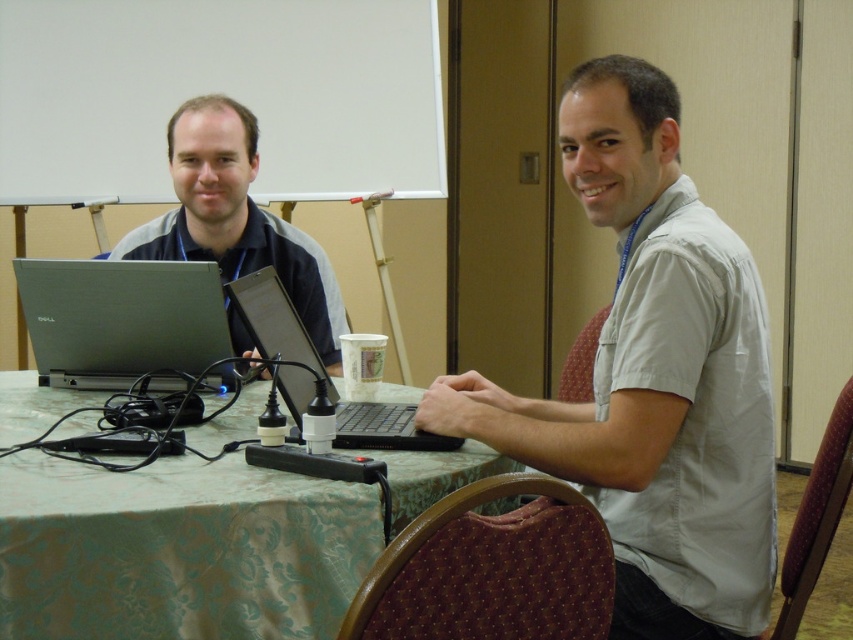
Question: Does light gray shirt at center have a smaller size compared to green fabric table at center?

Choices:
 (A) no
 (B) yes

Answer: (B)

Question: Which of the following is the farthest from the observer?

Choices:
 (A) (500, 406)
 (B) (85, 269)
 (C) (421, 438)
 (D) (335, 372)

Answer: (D)

Question: Observing the image, what is the correct spatial positioning of green fabric table at center in reference to black plastic laptop at center?

Choices:
 (A) above
 (B) below

Answer: (B)

Question: Which object appears closest to the camera in this image?

Choices:
 (A) silver metallic laptop at center
 (B) matte black laptop at left
 (C) green fabric table at center
 (D) light gray shirt at center

Answer: (C)

Question: Which of the following is the farthest from the observer?

Choices:
 (A) matte black laptop at left
 (B) black plastic laptop at center
 (C) green fabric table at center

Answer: (A)

Question: Where is green fabric table at center located in relation to silver metallic laptop at center in the image?

Choices:
 (A) above
 (B) below

Answer: (B)